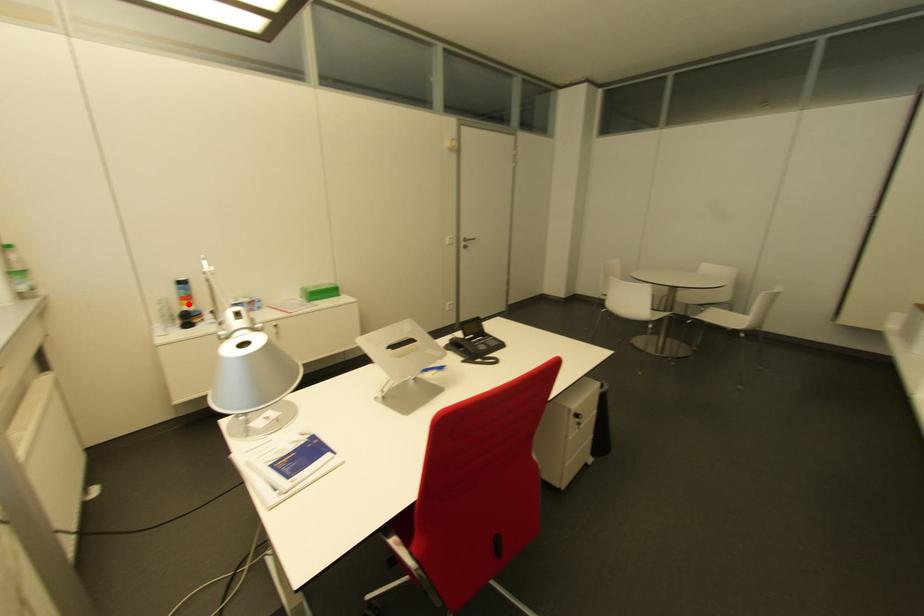
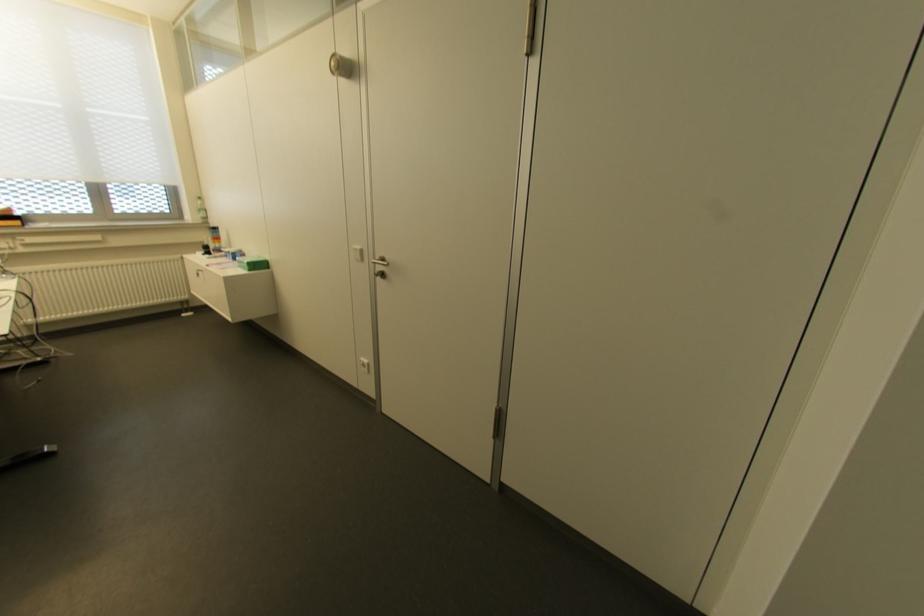
Locate, in the second image, the point that corresponds to the highlighted location in the first image.

(213, 243)